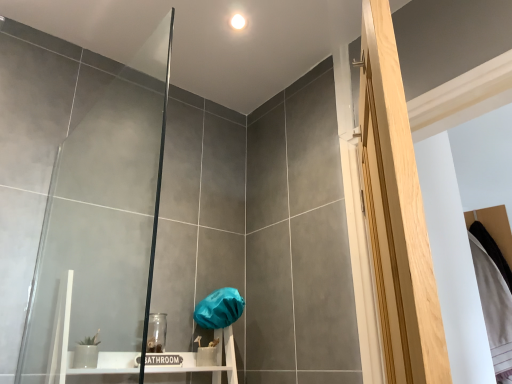
Question: Considering the positions of transparent glass door at left and light wood screen door at right in the image, is transparent glass door at left bigger or smaller than light wood screen door at right?

Choices:
 (A) big
 (B) small

Answer: (B)

Question: From a real-world perspective, is transparent glass door at left physically located above or below light wood screen door at right?

Choices:
 (A) above
 (B) below

Answer: (B)

Question: Which is correct: transparent glass door at left is inside light wood screen door at right, or outside of it?

Choices:
 (A) outside
 (B) inside

Answer: (A)

Question: Which is correct: light wood screen door at right is inside transparent glass door at left, or outside of it?

Choices:
 (A) inside
 (B) outside

Answer: (B)

Question: Is point (374, 41) positioned closer to the camera than point (89, 165)?

Choices:
 (A) farther
 (B) closer

Answer: (B)

Question: In the image, is light wood screen door at right positioned in front of or behind transparent glass door at left?

Choices:
 (A) front
 (B) behind

Answer: (A)

Question: Is light wood screen door at right taller or shorter than transparent glass door at left?

Choices:
 (A) tall
 (B) short

Answer: (A)